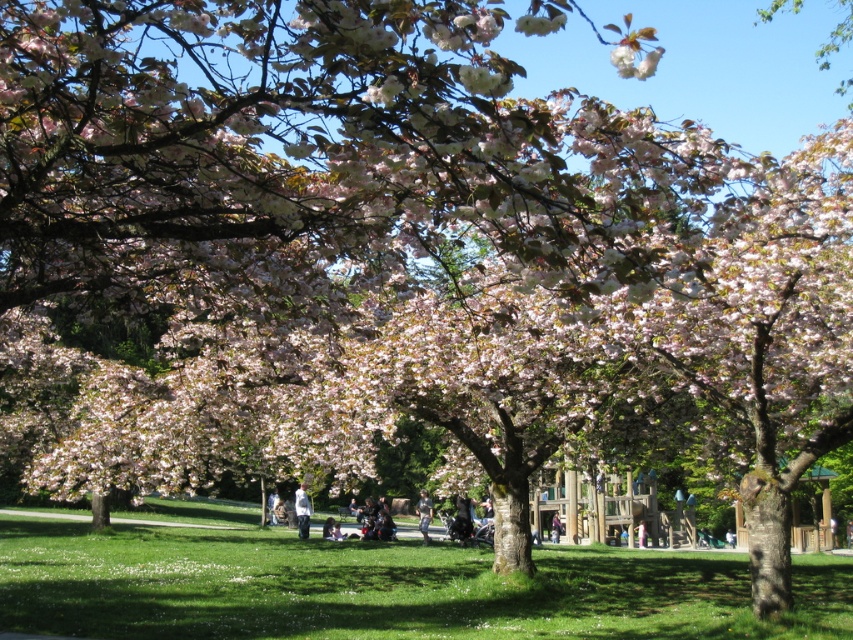
Is the position of green grass at center more distant than that of white cotton shirt at center?

No, it is not.

Locate an element on the screen. The image size is (853, 640). green grass at center is located at coordinates (376, 586).

Is white cotton shirt at center above dark blue jeans at center?

Yes.

Who is more forward, (x=302, y=532) or (x=556, y=518)?

→ Point (x=302, y=532) is more forward.

In order to click on white cotton shirt at center in this screenshot , I will do `click(302, 509)`.

Who is more forward, (112, 541) or (555, 540)?

Point (112, 541)

The image size is (853, 640). What do you see at coordinates (376, 586) in the screenshot?
I see `green grass at center` at bounding box center [376, 586].

At what (x,y) coordinates should I click in order to perform the action: click on green grass at center. Please return your answer as a coordinate pair (x, y). Image resolution: width=853 pixels, height=640 pixels. Looking at the image, I should click on (376, 586).